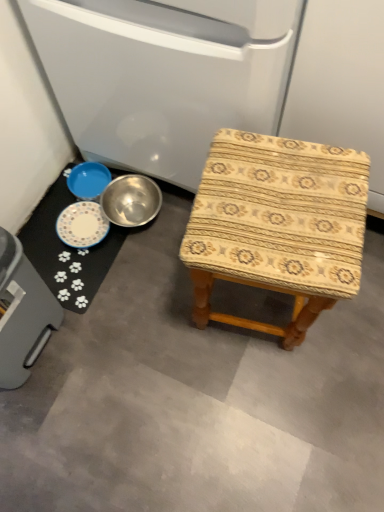
Locate an element on the screen. This screenshot has height=512, width=384. vacant area that lies to the right of gray plastic trash can at lower left, acting as the second appliance starting from the top is located at coordinates (119, 343).